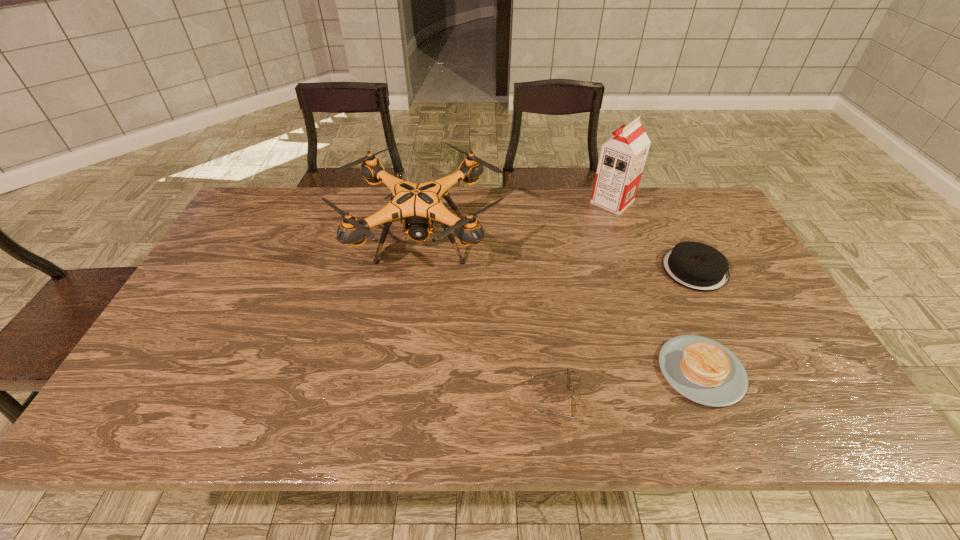
Identify the location of the tallest object. (622, 158).

Identify the location of the fourth shortest object. The width and height of the screenshot is (960, 540). (418, 204).

Identify the location of drone. Image resolution: width=960 pixels, height=540 pixels. (418, 204).

Identify the location of the farther pancake. The image size is (960, 540). point(694,265).

This screenshot has width=960, height=540. I want to click on the nearer pancake, so click(701, 369).

I want to click on the second object from left to right, so click(573, 405).

The image size is (960, 540). In order to click on free space located 0.170m on the right of the tallest object in this screenshot , I will do `click(684, 202)`.

This screenshot has height=540, width=960. In order to click on free location located 0.210m on the camera mount of the leftmost object in this screenshot , I will do `click(404, 368)`.

Where is `blank space located on the front of the farther pancake`? blank space located on the front of the farther pancake is located at coordinates (751, 382).

Locate an element on the screen. free space located 0.160m on the left of the nearer pancake is located at coordinates (590, 370).